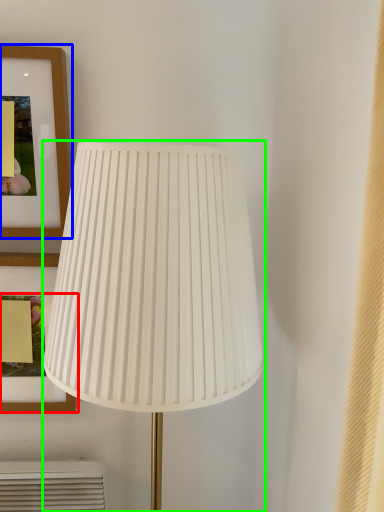
Question: Which is farther away from picture frame (highlighted by a red box)? picture frame (highlighted by a blue box) or lamp (highlighted by a green box)?

Choices:
 (A) picture frame
 (B) lamp

Answer: (A)